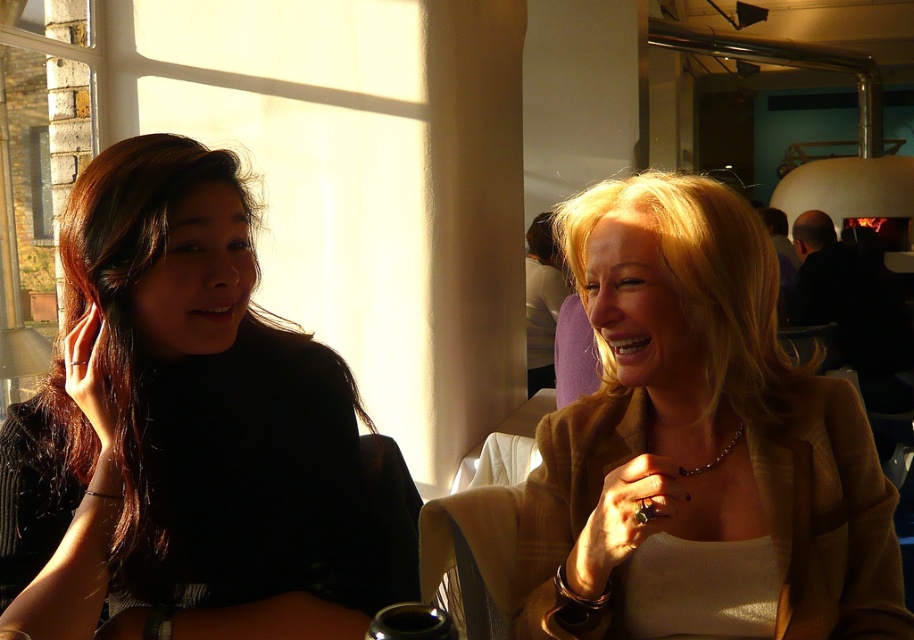
You are a photographer setting up a shoot in this scene. You want to position a light source to the left of the black matte shirt at left and the matte gold blazer at center. Based on their widths, which object should you place the light closer to?

The black matte shirt at left might be wider than matte gold blazer at center, so you should place the light closer to the matte gold blazer at center to ensure proper illumination.

From the picture: You are a photographer setting up for a portrait session. You need to position a spotlight to the right of both the black matte shirt at left and the matte gold blazer at center. Is this possible given their positions?

The black matte shirt at left is to the left of the matte gold blazer at center. Since the spotlight needs to be positioned to the right of both, it is possible as the matte gold blazer at center is already to the right of the black matte shirt at left, so placing the spotlight further to the right of the matte gold blazer at center would satisfy both conditions.